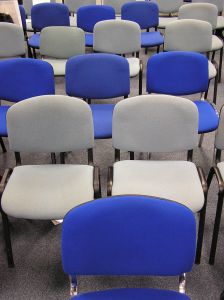
Find the location of `chair back`. chair back is located at coordinates click(119, 262).